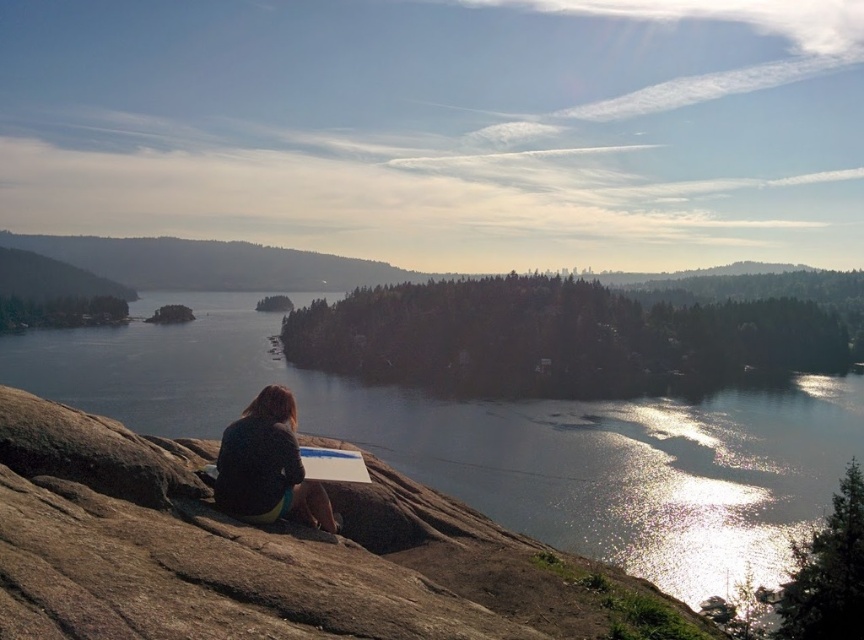
You are a photographer trying to capture the scene of the person sitting on the rocky outcrop. You want to ensure that both the glistening water at center and the dark blue fabric at center are visible in your shot. Based on their positions, which object should you place closer to the left side of your camera frame?

The glistening water at center should be placed closer to the left side of your camera frame because it is positioned to the left of the dark blue fabric at center.

You are standing at the edge of the water and want to place a small boat on the glistening water at center. The boat requires at least 1 meter of space to avoid the dark blue fabric at center. Can you determine if there is enough space between them?

The glistening water at center might be wider than dark blue fabric at center, so there may be sufficient space for the boat. However, the exact width isn not specified, so it is uncertain.

You are a photographer aiming to capture the reflection of the dark blue fabric at center in the glistening water at center. Based on the scene description, is the positioning of these objects suitable for capturing a clear reflection?

The glistening water at center is located below the dark blue fabric at center, so the dark blue fabric at center is positioned above the water. This placement allows its reflection to be visible on the water surface, making it possible to capture a clear reflection.